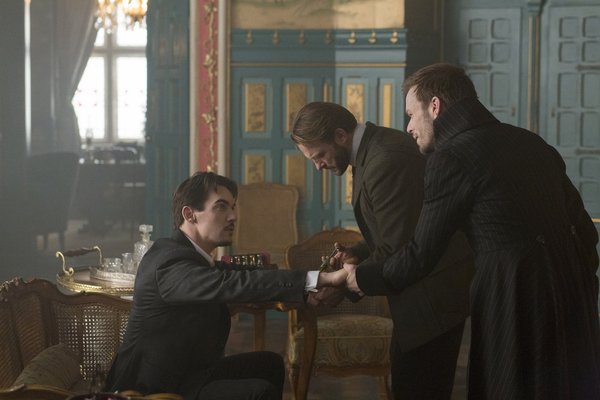
Identify the location of table. (125, 282).